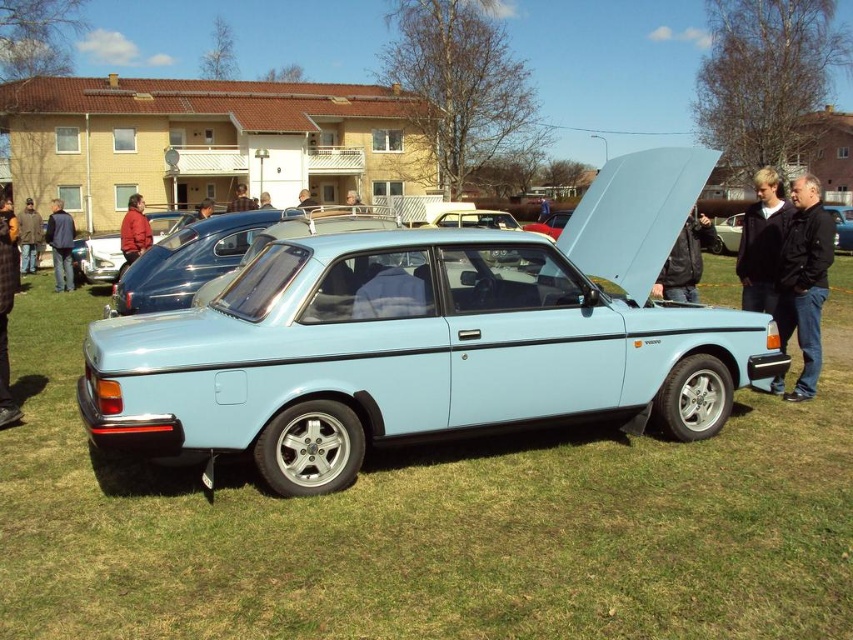
Question: Considering the real-world distances, which object is closest to the dark brown leather jacket at left?

Choices:
 (A) smooth leather jacket at center
 (B) green grass at center
 (C) dark brown leather jacket at center

Answer: (C)

Question: Is green grass at center closer to camera compared to black leather jacket at center?

Choices:
 (A) no
 (B) yes

Answer: (B)

Question: Which point is closer to the camera?

Choices:
 (A) red wool sweater at center
 (B) metallic blue car at center

Answer: (A)

Question: Which object appears closest to the camera in this image?

Choices:
 (A) blue fabric jacket at center
 (B) smooth leather jacket at center
 (C) light blue metallic car at center

Answer: (C)

Question: Is black leather jacket at center positioned in front of dark blue leather jacket at center?

Choices:
 (A) no
 (B) yes

Answer: (B)

Question: Can you confirm if light brown leather jacket at right is bigger than blue fabric jacket at center?

Choices:
 (A) yes
 (B) no

Answer: (A)